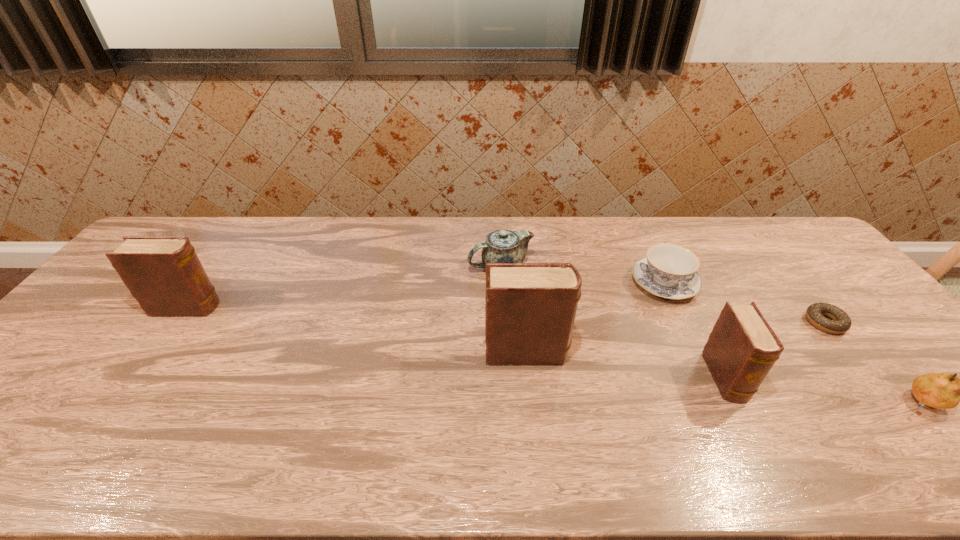
The image size is (960, 540). In order to click on free space between the farthest diary and the second diary from right to left in this screenshot , I will do `click(357, 329)`.

Identify the location of vacant area that lies between the second tallest object and the second diary from right to left. (357, 329).

You are a GUI agent. You are given a task and a screenshot of the screen. Output one action in this format:
    pyautogui.click(x=<x>, y=<y>)
    Task: Click on the free space between the pear and the doughnut
    This screenshot has height=540, width=960.
    Given the screenshot: What is the action you would take?
    pyautogui.click(x=872, y=362)

Where is `empty location between the pear and the shortest object`? The width and height of the screenshot is (960, 540). empty location between the pear and the shortest object is located at coordinates (872, 362).

Locate an element on the screen. The width and height of the screenshot is (960, 540). vacant space in between the second tallest object and the shorter chinaware is located at coordinates (425, 295).

This screenshot has height=540, width=960. In order to click on vacant area that lies between the shortest object and the shorter chinaware in this screenshot , I will do `click(744, 302)`.

Locate an element on the screen. The width and height of the screenshot is (960, 540). the fourth closest object to the third tallest object is located at coordinates (530, 309).

This screenshot has height=540, width=960. Find the location of `the fourth closest object to the second diary from right to left`. the fourth closest object to the second diary from right to left is located at coordinates [x=841, y=322].

Point out which diary is positioned as the third nearest to the left chinaware. Please provide its 2D coordinates. Your answer should be formatted as a tuple, i.e. [(x, y)], where the tuple contains the x and y coordinates of a point satisfying the conditions above.

[(164, 274)]

You are a GUI agent. You are given a task and a screenshot of the screen. Output one action in this format:
    pyautogui.click(x=<x>, y=<y>)
    Task: Click on the diary that stands as the third closest to the pear
    The image size is (960, 540).
    Given the screenshot: What is the action you would take?
    pyautogui.click(x=164, y=274)